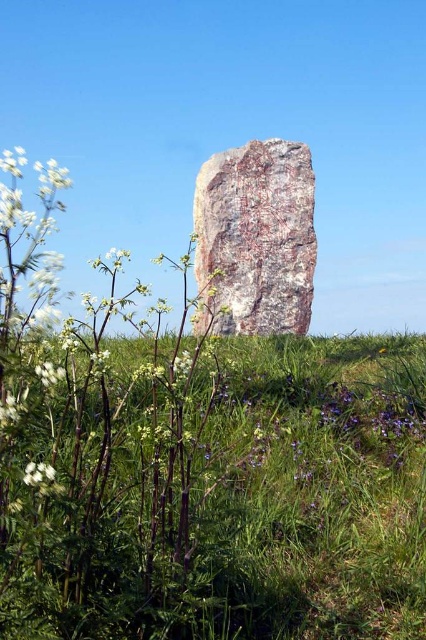
You are standing in the field looking at the scene. Which object is closer to you between the green grass at center and the rusty stone at center?

The green grass at center is closer to the viewer than the rusty stone at center.

You are standing in the open grassy field and want to place a small marker exactly at the center of the image. According to the image, where should you place the marker relative to the green grass at center?

The green grass at center is already located at the center of the image, so placing the marker there would position it directly at the green grass at center.